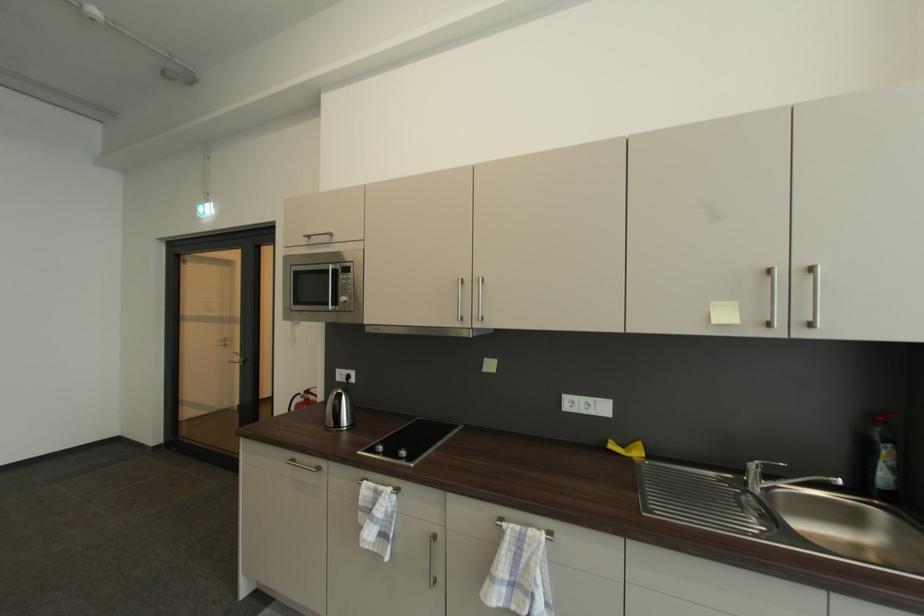
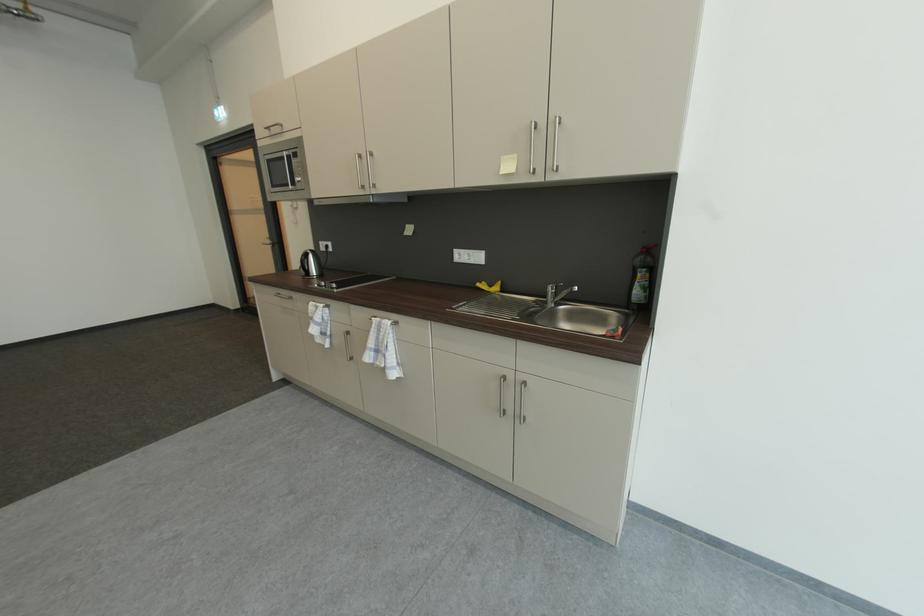
The point at (613, 443) is marked in the first image. Where is the corresponding point in the second image?

(487, 284)